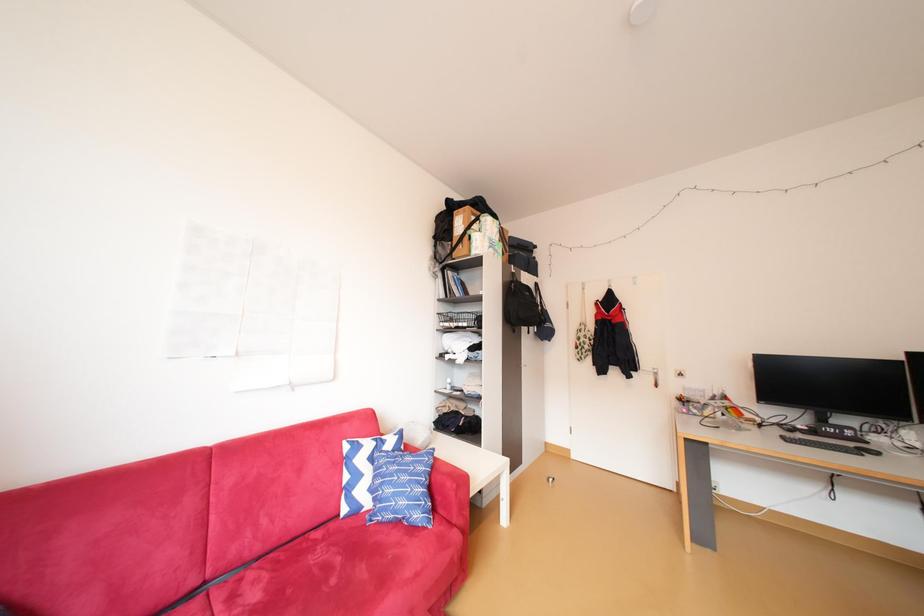
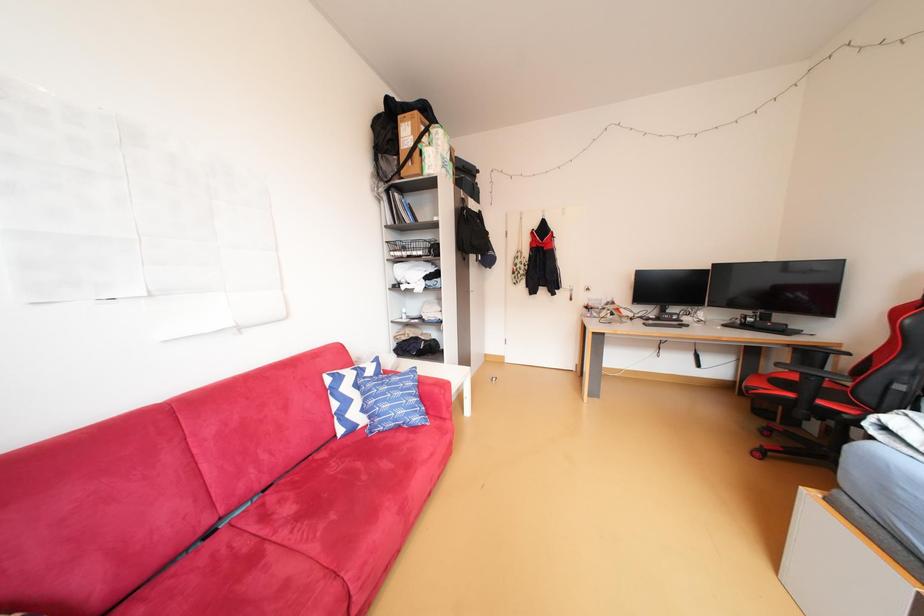
Question: The images are taken continuously from a first-person perspective. In which direction are you moving?

Choices:
 (A) Left
 (B) Right
 (C) Forward
 (D) Backward

Answer: (A)